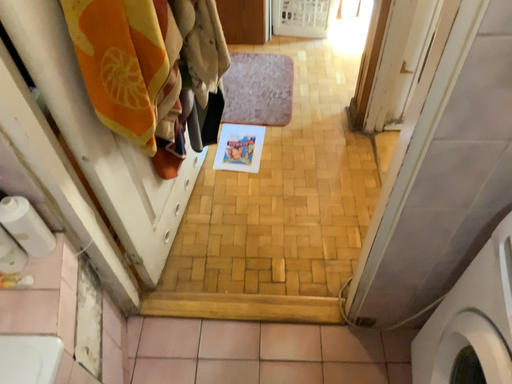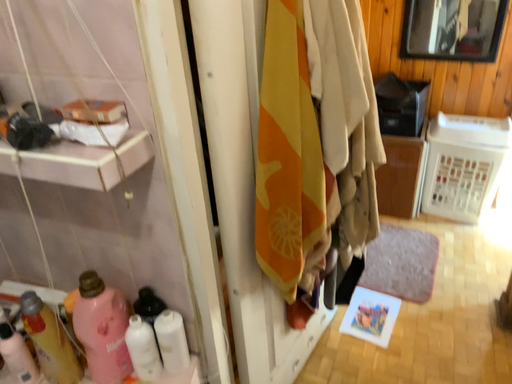
Question: How did the camera likely rotate when shooting the video?

Choices:
 (A) rotated right
 (B) rotated left

Answer: (B)